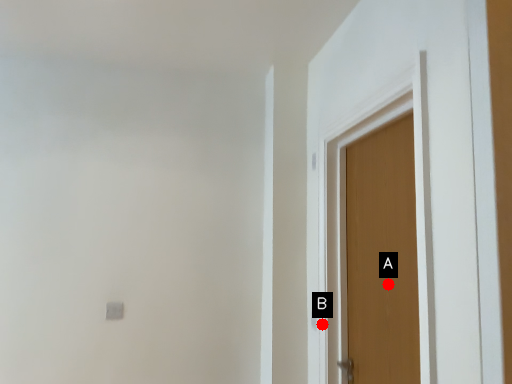
Question: Two points are circled on the image, labeled by A and B beside each circle. Which point appears closest to the camera in this image?

Choices:
 (A) A is closer
 (B) B is closer

Answer: (A)